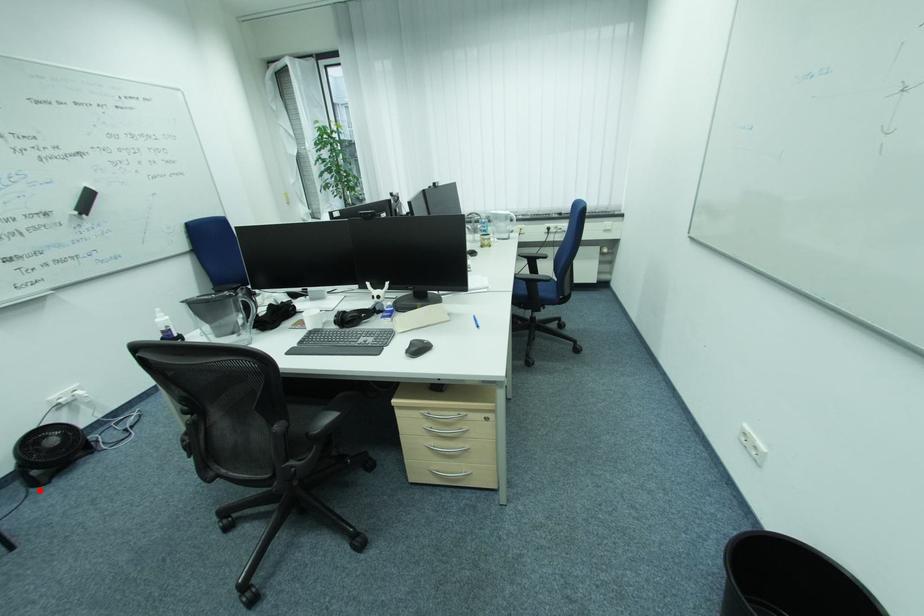
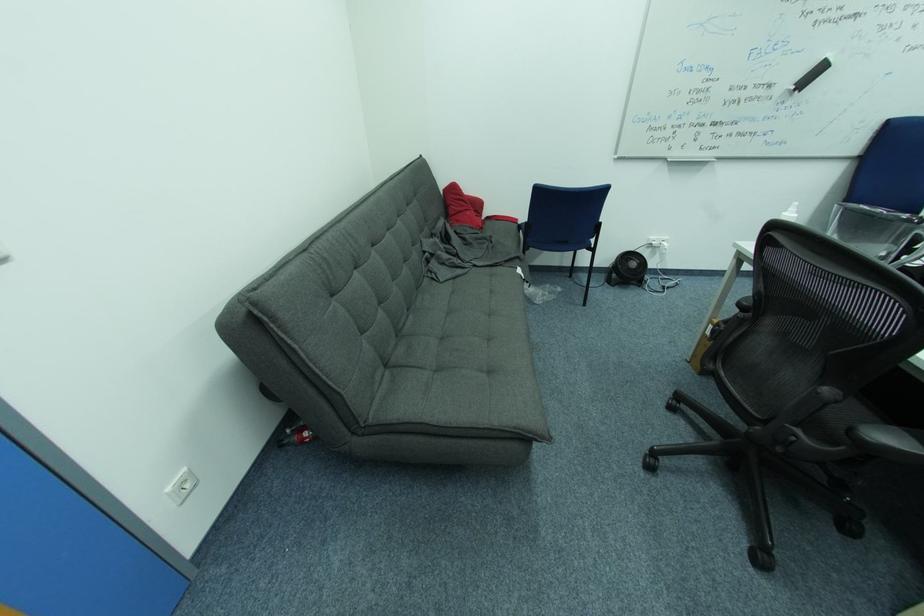
Question: I am providing you with two images of the same scene from different viewpoints. Given a red point in image1, look at the same physical point in image2. Is it:

Choices:
 (A) Closer to the viewpoint
 (B) Farther from the viewpoint

Answer: (A)